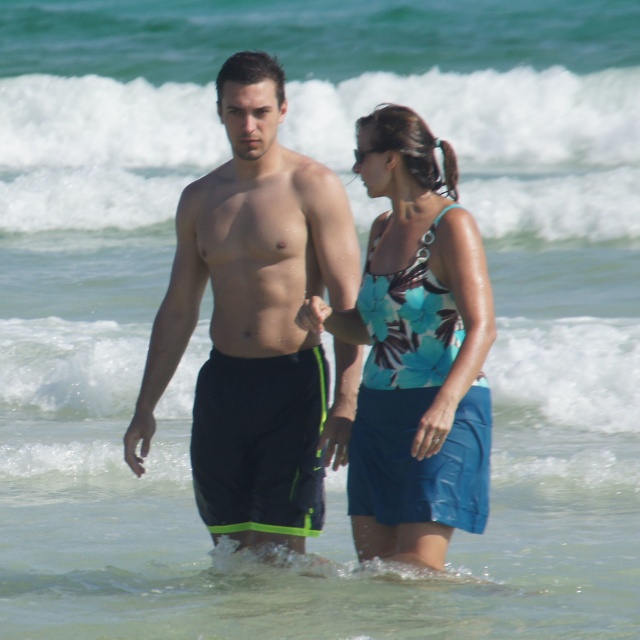
You are a photographer trying to capture a closeup of the black matte shorts at center and the matte black hand at center. Since you want both to be in focus, which object should you adjust your camera focus on first, the larger or the smaller one?

The black matte shorts at center is bigger than the matte black hand at center, so you should focus on the larger object first to ensure both are in focus.